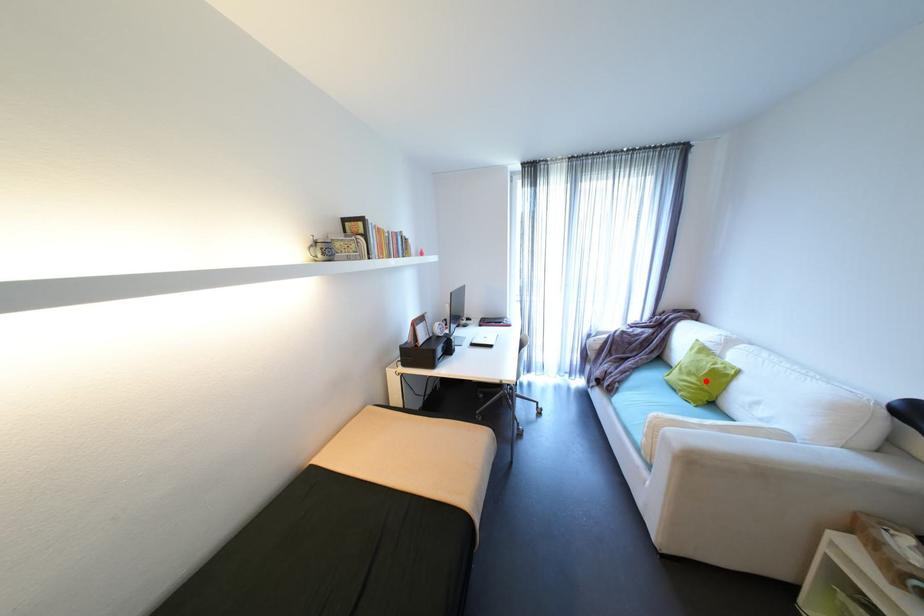
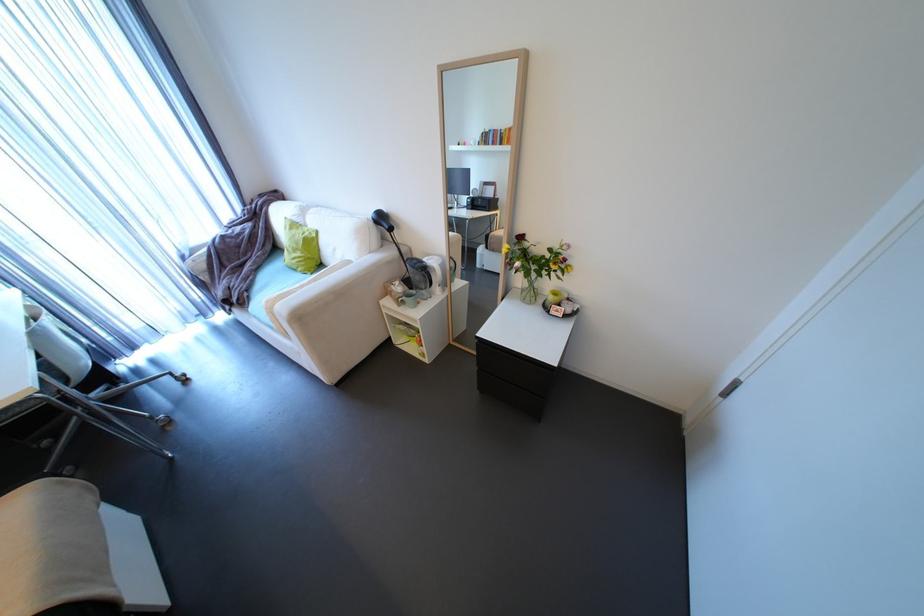
In the second image, find the point that corresponds to the highlighted location in the first image.

(310, 253)